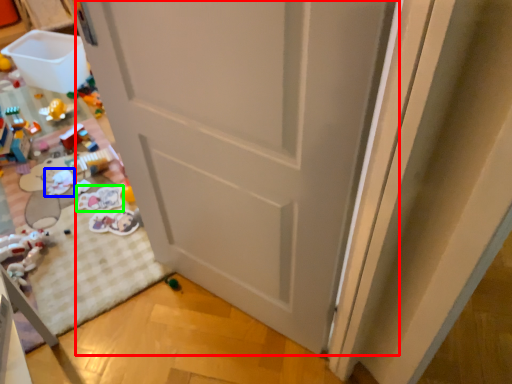
Question: Based on their relative distances, which object is farther from door (highlighted by a red box)? Choose from toy (highlighted by a blue box) and toy (highlighted by a green box).

Choices:
 (A) toy
 (B) toy

Answer: (A)